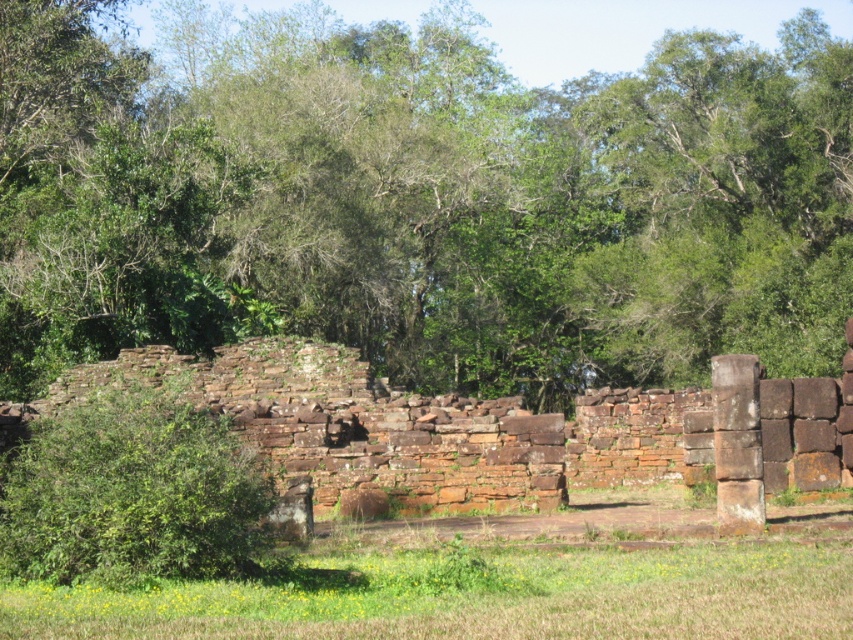
You are an archaeologist examining the ancient site. You notice the brown stone ruins at center and the green grass at lower center. Which object is located above the other?

The brown stone ruins at center is positioned over green grass at lower center, meaning the ruins are above the grass.